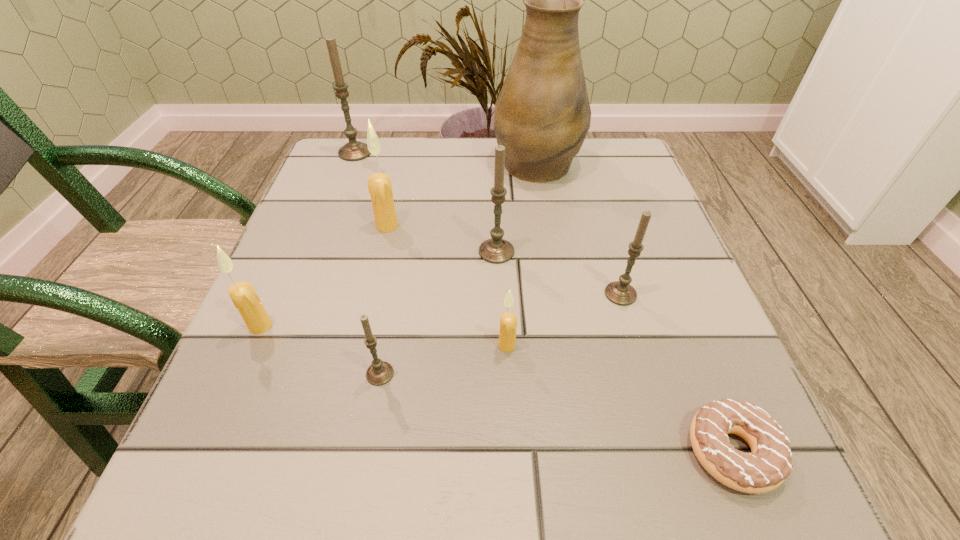
You are a GUI agent. You are given a task and a screenshot of the screen. Output one action in this format:
    pyautogui.click(x=<x>, y=<y>)
    Task: Click on the free space located on the front of the second biggest cream candle
    
    Given the screenshot: What is the action you would take?
    pyautogui.click(x=187, y=494)

Find the location of `free space located 0.240m on the back of the fourth nearest candle`. free space located 0.240m on the back of the fourth nearest candle is located at coordinates (593, 201).

What are the coordinates of `free space located 0.180m on the right of the nearest cream candle` in the screenshot? It's located at (631, 345).

I want to click on free space located 0.210m on the left of the second nearest object, so click(225, 374).

Locate an element on the screen. This screenshot has width=960, height=540. vacant space located 0.370m on the back of the nearest object is located at coordinates (646, 236).

Where is `pitcher at the far edge`? pitcher at the far edge is located at coordinates (542, 115).

You are a GUI agent. You are given a task and a screenshot of the screen. Output one action in this format:
    pyautogui.click(x=<x>, y=<y>)
    Task: Click on the candle located at the far edge
    
    Given the screenshot: What is the action you would take?
    pyautogui.click(x=354, y=150)

Find the location of `object positioned at the near edge`. object positioned at the near edge is located at coordinates (768, 465).

At what (x,y) coordinates should I click in order to perform the action: click on pitcher at the right edge. Please return your answer as a coordinate pair (x, y). This screenshot has height=540, width=960. Looking at the image, I should click on (542, 115).

Where is `candle located at the right edge`? This screenshot has height=540, width=960. candle located at the right edge is located at coordinates (620, 292).